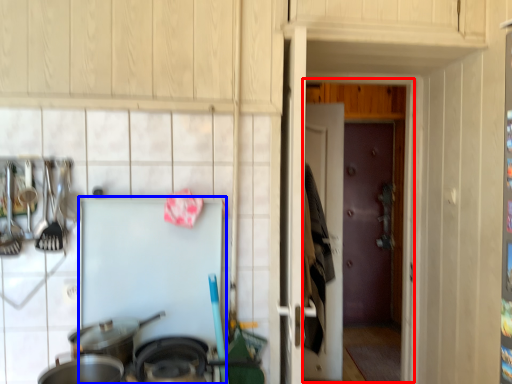
Question: Among these objects, which one is nearest to the camera, glass door (highlighted by a red box) or appliance (highlighted by a blue box)?

Choices:
 (A) glass door
 (B) appliance

Answer: (B)